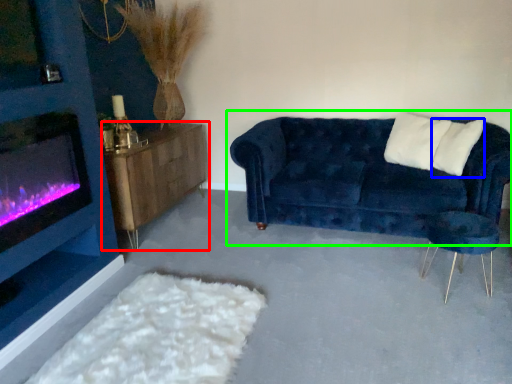
Question: Which is farther away from table (highlighted by a red box)? pillow (highlighted by a blue box) or studio couch (highlighted by a green box)?

Choices:
 (A) pillow
 (B) studio couch

Answer: (A)